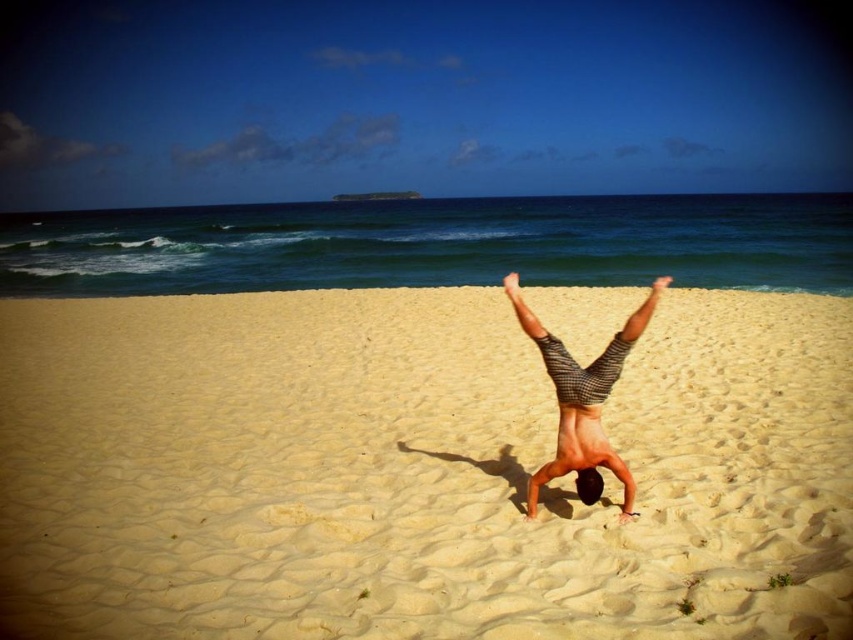
Question: Where is smooth yellow sand at center located in relation to striped shorts at center in the image?

Choices:
 (A) left
 (B) right

Answer: (A)

Question: Which point is farther to the camera?

Choices:
 (A) (39, 554)
 (B) (628, 513)

Answer: (B)

Question: Is smooth yellow sand at center in front of striped shorts at center?

Choices:
 (A) yes
 (B) no

Answer: (A)

Question: Among these objects, which one is nearest to the camera?

Choices:
 (A) smooth yellow sand at center
 (B) striped shorts at center

Answer: (A)

Question: In this image, where is smooth yellow sand at center located relative to striped shorts at center?

Choices:
 (A) above
 (B) below

Answer: (A)

Question: Which of the following is the closest to the observer?

Choices:
 (A) smooth yellow sand at center
 (B) striped shorts at center

Answer: (A)